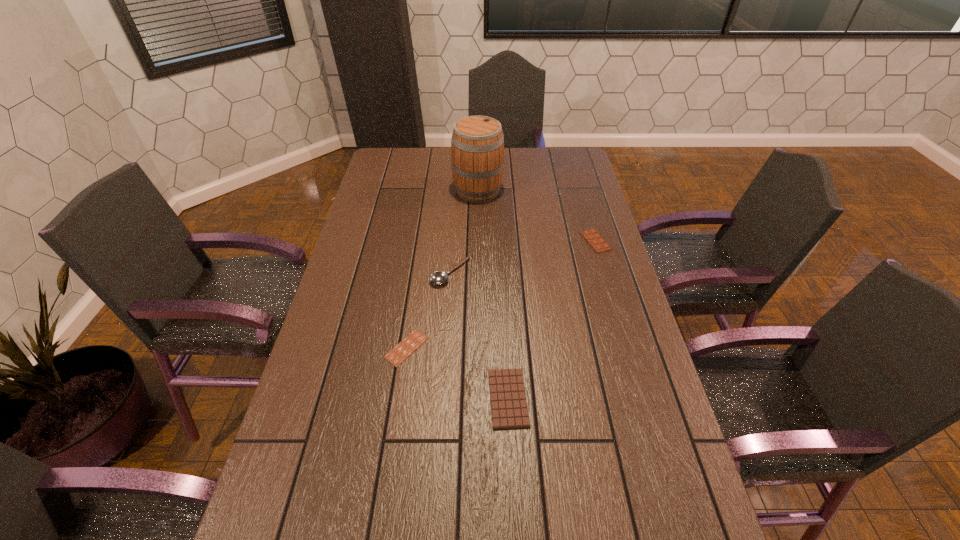
This screenshot has height=540, width=960. Identify the location of vacant area that lies between the fourth nearest object and the nearest object. (552, 320).

I want to click on free space that is in between the second shortest chocolate bar and the third nearest object, so click(x=479, y=335).

At what (x,y) coordinates should I click in order to perform the action: click on vacant region between the second farthest chocolate bar and the farthest object. Please return your answer as a coordinate pair (x, y). Image resolution: width=960 pixels, height=540 pixels. Looking at the image, I should click on (443, 269).

This screenshot has height=540, width=960. What are the coordinates of `vacant area that lies between the nearest chocolate bar and the rightmost chocolate bar` in the screenshot? It's located at (552, 320).

This screenshot has height=540, width=960. What are the coordinates of `free point between the fourth nearest object and the farthest object` in the screenshot? It's located at (537, 216).

The image size is (960, 540). What are the coordinates of `free space between the farthest object and the farthest chocolate bar` in the screenshot? It's located at (537, 216).

I want to click on unoccupied position between the second chocolate bar from left to right and the ladle, so click(479, 335).

Image resolution: width=960 pixels, height=540 pixels. I want to click on blank region between the second chocolate bar from right to left and the second nearest object, so click(x=457, y=373).

The height and width of the screenshot is (540, 960). Identify the location of empty space between the leftmost chocolate bar and the nearest object. (457, 373).

Locate an element on the screen. The width and height of the screenshot is (960, 540). free area in between the cider and the farthest chocolate bar is located at coordinates (537, 216).